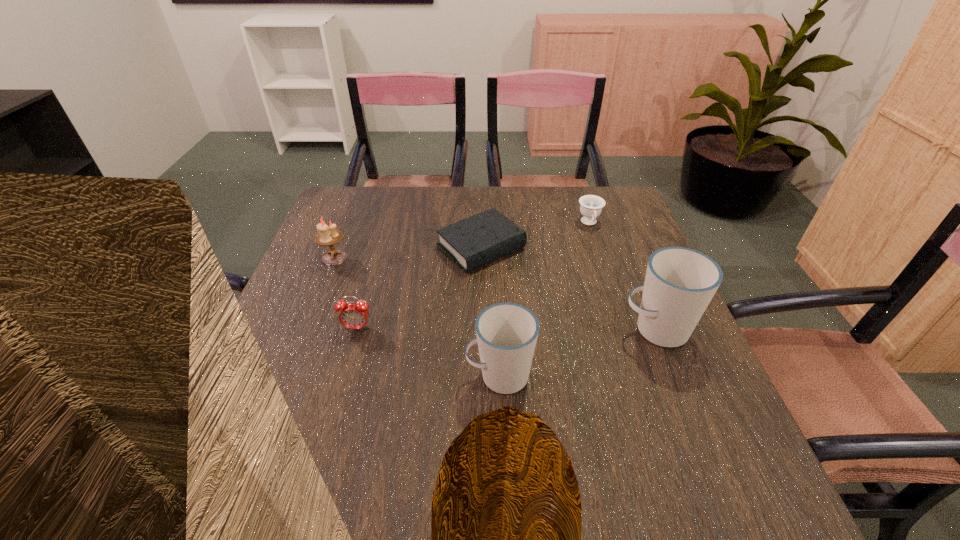
At what (x,y) coordinates should I click in order to perform the action: click on free spot located 0.080m with a handle on the side of the left cup. Please return your answer as a coordinate pair (x, y). The image size is (960, 540). Looking at the image, I should click on pyautogui.click(x=426, y=376).

The height and width of the screenshot is (540, 960). Identify the location of vacant space located 0.400m with a handle on the side of the right cup. (440, 330).

Locate an element on the screen. vacant space located with a handle on the side of the right cup is located at coordinates tap(458, 330).

Find the location of `blank space located with a handle on the side of the right cup`. blank space located with a handle on the side of the right cup is located at coordinates (539, 330).

The height and width of the screenshot is (540, 960). I want to click on vacant space located 0.330m on the left of the shortest object, so click(x=315, y=247).

The image size is (960, 540). Identify the location of vacant space located on the side of the teacup with the handle. (628, 340).

The height and width of the screenshot is (540, 960). I want to click on vacant space located 0.060m on the back of the leftmost object, so click(343, 237).

The height and width of the screenshot is (540, 960). What are the coordinates of `vacant space located on the face of the fourth tallest object` in the screenshot? It's located at (326, 438).

This screenshot has width=960, height=540. Find the location of `Bible situated at the far edge`. Bible situated at the far edge is located at coordinates (473, 242).

The width and height of the screenshot is (960, 540). I want to click on teacup at the far edge, so click(591, 206).